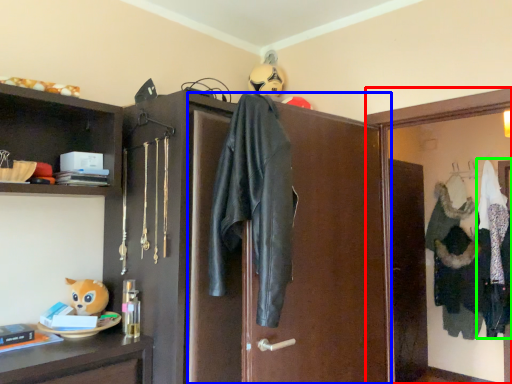
Question: Estimate the real-world distances between objects in this image. Which object is farther from medicine cabinet (highlighted by a red box), screen door (highlighted by a blue box) or clothing (highlighted by a green box)?

Choices:
 (A) screen door
 (B) clothing

Answer: (B)